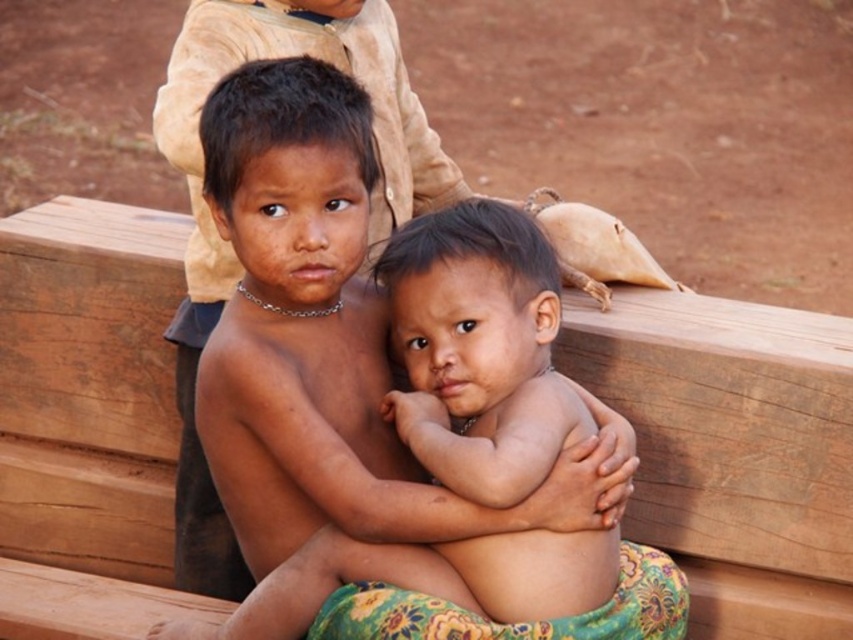
You are a photographer setting up for a family photo. You see the brown wooden bench at center and the smooth skin child at center in the scene. Which object is located to the right of the other?

The smooth skin child at center is to the right of the brown wooden bench at center because the bench is on the left side of the child according to the description.

You are a photographer setting up a shot of the brown wooden bench at center and the smooth skin child at center. Which object takes up more area in the image?

The smooth skin child at center takes up more area in the image than the brown wooden bench at center because the brown wooden bench at center occupies less space than smooth skin child at center.